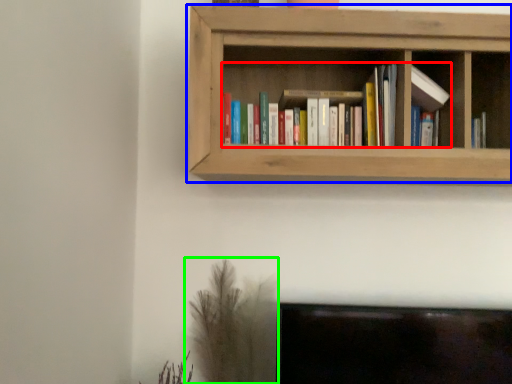
Question: Which is farther away from book (highlighted by a red box)? shelf (highlighted by a blue box) or plant (highlighted by a green box)?

Choices:
 (A) shelf
 (B) plant

Answer: (B)